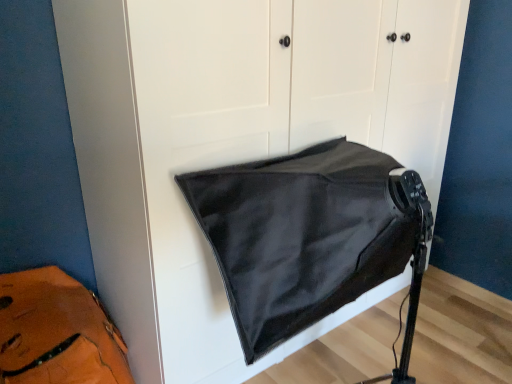
Question: Is black matte/satin sleeping bag at center located within leather at left?

Choices:
 (A) yes
 (B) no

Answer: (B)

Question: Is black matte/satin sleeping bag at center at the back of leather at left?

Choices:
 (A) no
 (B) yes

Answer: (A)

Question: Would you say leather at left is outside black matte/satin sleeping bag at center?

Choices:
 (A) no
 (B) yes

Answer: (B)

Question: Is leather at left to the right of black matte/satin sleeping bag at center from the viewer's perspective?

Choices:
 (A) no
 (B) yes

Answer: (A)

Question: From the image's perspective, is leather at left over black matte/satin sleeping bag at center?

Choices:
 (A) yes
 (B) no

Answer: (B)

Question: Is leather at left bigger than black matte/satin sleeping bag at center?

Choices:
 (A) no
 (B) yes

Answer: (A)

Question: Does black matte/satin sleeping bag at center touch leather at left?

Choices:
 (A) yes
 (B) no

Answer: (B)

Question: Does black matte/satin sleeping bag at center come in front of leather at left?

Choices:
 (A) yes
 (B) no

Answer: (A)

Question: Does black matte/satin sleeping bag at center have a lesser height compared to leather at left?

Choices:
 (A) yes
 (B) no

Answer: (B)

Question: From the image's perspective, is black matte/satin sleeping bag at center under leather at left?

Choices:
 (A) yes
 (B) no

Answer: (B)

Question: Can you confirm if black matte/satin sleeping bag at center is smaller than leather at left?

Choices:
 (A) no
 (B) yes

Answer: (A)

Question: Is black matte/satin sleeping bag at center further to camera compared to leather at left?

Choices:
 (A) no
 (B) yes

Answer: (A)

Question: Is black matte/satin sleeping bag at center inside the boundaries of leather at left, or outside?

Choices:
 (A) outside
 (B) inside

Answer: (A)